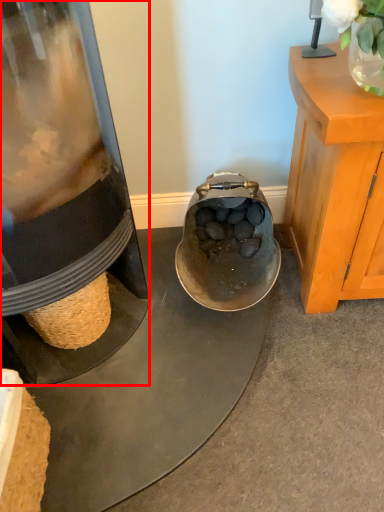
Question: From the image's perspective, where is appliance (annotated by the red box) located in relation to plant in the image?

Choices:
 (A) below
 (B) above

Answer: (A)